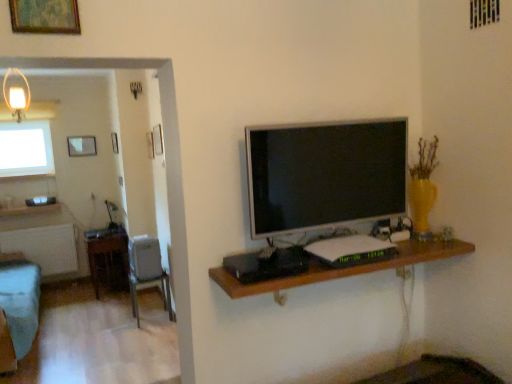
Question: Considering the positions of point (22, 87) and point (76, 142), is point (22, 87) closer or farther from the camera than point (76, 142)?

Choices:
 (A) closer
 (B) farther

Answer: (A)

Question: Looking at their shapes, would you say matte glass lampshade at upper left is wider or thinner than matte glass picture frame at upper left, the third picture frame positioned from the front?

Choices:
 (A) thin
 (B) wide

Answer: (B)

Question: Estimate the real-world distances between objects in this image. Which object is closer to the matte glass picture frame at upper left, the 1th picture frame from the back?

Choices:
 (A) teal fabric couch at left
 (B) wooden table at left
 (C) metallic gray chair at lower left
 (D) silver metallic television at center
 (E) gold-framed artwork at upper left, the third picture frame when ordered from back to front

Answer: (B)

Question: Which of these objects is positioned farthest from the gold-framed artwork at upper left, the third picture frame positioned from the left?

Choices:
 (A) matte glass picture frame at upper left, the 1th picture frame from the back
 (B) matte glass lampshade at upper left
 (C) silver metallic television at center
 (D) wooden picture frame at upper left, which ranks as the 2th picture frame in back-to-front order
 (E) wooden table at left

Answer: (A)